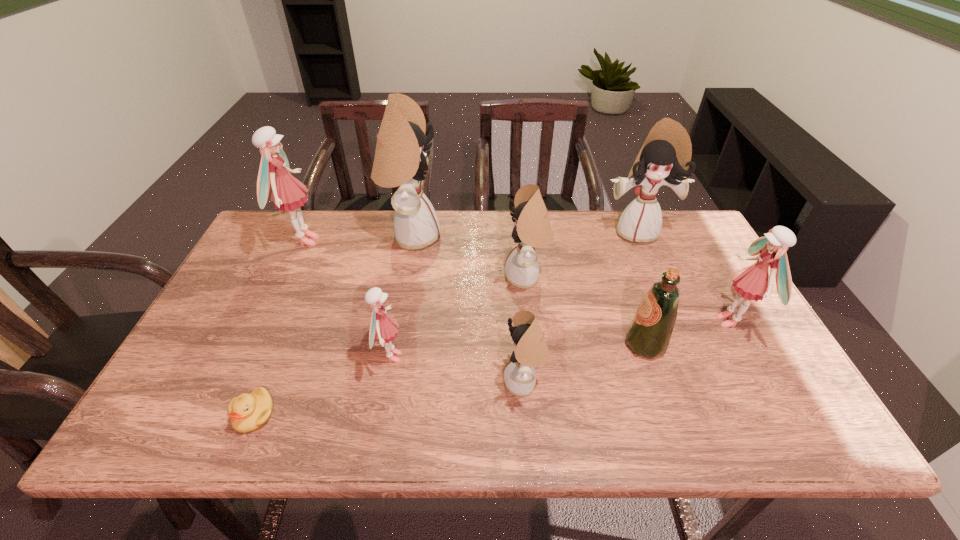
The image size is (960, 540). I want to click on the biggest black doll, so click(x=400, y=160).

Identify the location of the leftmost black doll. (400, 160).

The height and width of the screenshot is (540, 960). Find the location of `the biggest pink doll`. the biggest pink doll is located at coordinates (286, 191).

You are a GUI agent. You are given a task and a screenshot of the screen. Output one action in this format:
    pyautogui.click(x=<x>, y=<y>)
    Task: Click on the leftmost pink doll
    
    Given the screenshot: What is the action you would take?
    pyautogui.click(x=286, y=191)

Where is `the rightmost black doll`? This screenshot has width=960, height=540. the rightmost black doll is located at coordinates (665, 156).

Find the location of `the rightmost pink doll`. the rightmost pink doll is located at coordinates (753, 282).

Find the location of `the second smallest black doll`. the second smallest black doll is located at coordinates (532, 229).

The width and height of the screenshot is (960, 540). In order to click on olive oil in this screenshot , I will do `click(649, 333)`.

The height and width of the screenshot is (540, 960). Identify the location of the second pink doll from left to right. (383, 328).

Find the location of a particular element. The image size is (960, 540). the nearest black doll is located at coordinates (531, 350).